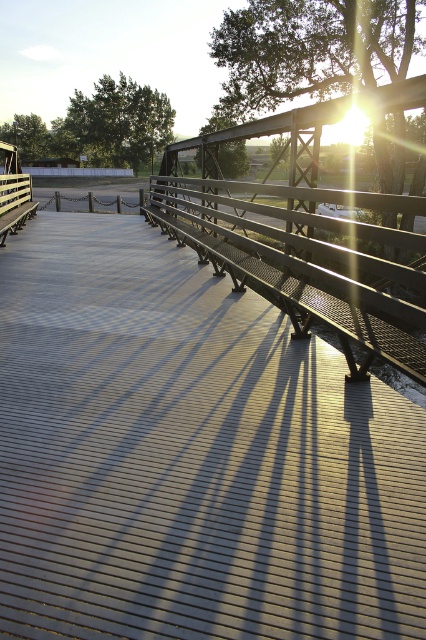
You are standing on the bridge and want to place a small potted plant on the metallic gray dock at center. To ensure it doesn

The metallic gray dock at center is located at coordinates point (190, 456), so you should place the potted plant there.

You are standing on the walkway of the pedestrian bridge and want to sit down. There is a metallic gray dock at center and a metallic gray bench at center. Which one is closer to you so you can sit?

The metallic gray dock at center is closer to the viewer than the metallic gray bench at center, so you should sit on the metallic gray dock at center.